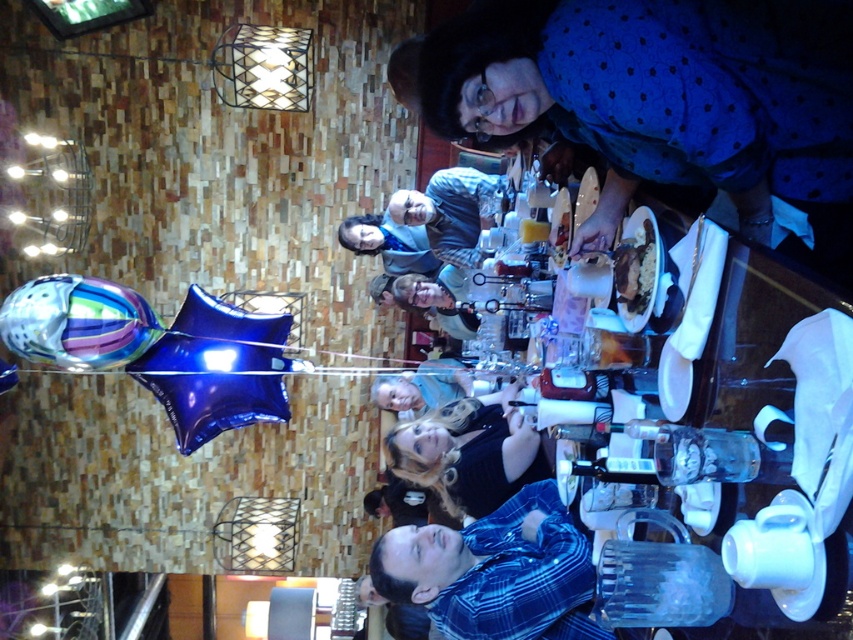
You are a photographer who needs to adjust the lighting for a closeup shot of the blue plaid shirt at lower center and the multicolored glossy balloon at lower left. Since the scene is rotated, you need to know which object is bigger to focus properly. Which object has a bigger size?

The blue plaid shirt at lower center has a larger size compared to the multicolored glossy balloon at lower left, so the blue plaid shirt at lower center is bigger.

You are a photographer who just rotated this image back to its original upright position. Now you want to take a closeup shot of the multicolored glossy balloon at lower left and the matte gray sweater at center. Which object will appear closer to the camera in your closeup photo?

The multicolored glossy balloon at lower left is in front of the matte gray sweater at center, so it will appear closer to the camera in the closeup photo.

Based on the photo, you are a photographer trying to capture a closeup of the blue plaid shirt at lower center and the multicolored glossy balloon at lower left. Since the image is rotated, you need to adjust your camera angle. Which object should you focus on first to ensure it appears larger in the photo?

The blue plaid shirt at lower center is closer to the viewer than the multicolored glossy balloon at lower left, so focusing on it first will make it appear larger in the photo.